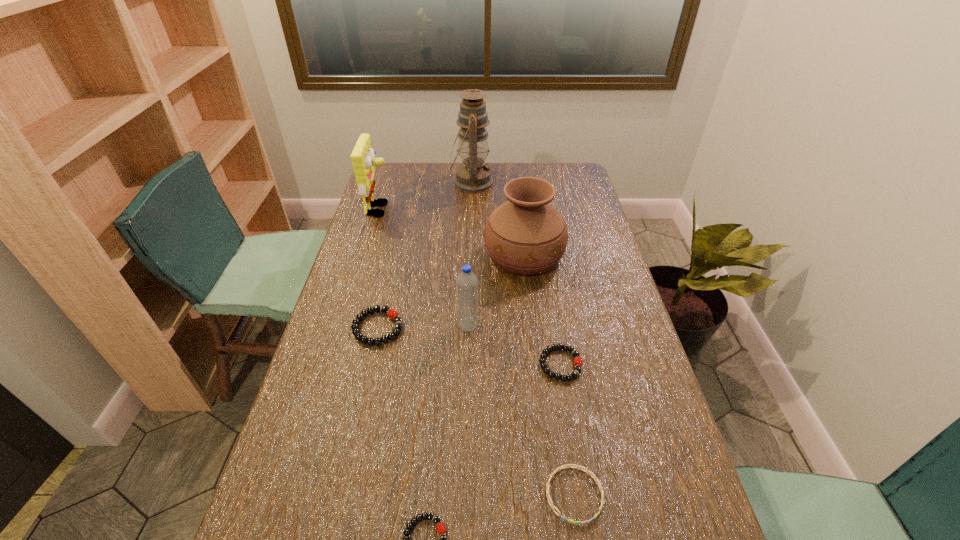
Where is `vacant point at the far edge`? vacant point at the far edge is located at coordinates (418, 190).

At what (x,y) coordinates should I click in order to perform the action: click on vacant space at the left edge. Please return your answer as a coordinate pair (x, y). The image size is (960, 540). Looking at the image, I should click on (286, 436).

In the image, there is a desktop. Where is `free space at the right edge`? The width and height of the screenshot is (960, 540). free space at the right edge is located at coordinates (574, 303).

Where is `vacant region at the far left corner of the desktop`? The image size is (960, 540). vacant region at the far left corner of the desktop is located at coordinates (395, 173).

The width and height of the screenshot is (960, 540). I want to click on vacant space at the far right corner, so click(582, 184).

The image size is (960, 540). I want to click on free spot between the blue bracelet and the sponge, so click(x=477, y=352).

Locate an element on the screen. empty location between the urn and the rightmost black bracelet is located at coordinates (542, 309).

The image size is (960, 540). I want to click on vacant area between the water bottle and the sponge, so click(x=424, y=268).

You are a GUI agent. You are given a task and a screenshot of the screen. Output one action in this format:
    pyautogui.click(x=<x>, y=<y>)
    Task: Click on the vacant area that lies between the second smallest black bracelet and the urn
    The width and height of the screenshot is (960, 540).
    Given the screenshot: What is the action you would take?
    pyautogui.click(x=542, y=309)

The image size is (960, 540). I want to click on object that ranks as the sixth closest to the leftmost bracelet, so click(x=586, y=470).